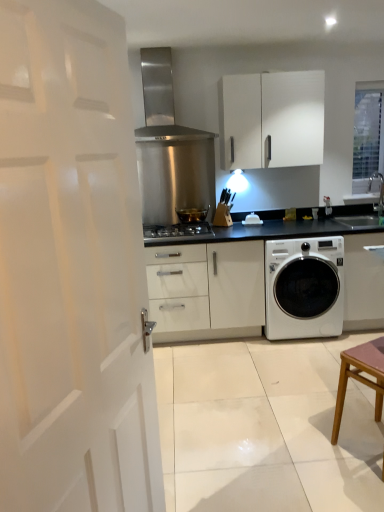
Identify the location of blank space above clear glass window at upper right (from a real-world perspective). (370, 82).